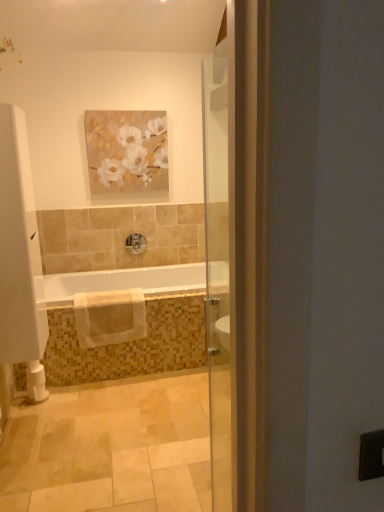
Question: From the image's perspective, would you say white towel at center is shown under matte floral painting at upper center?

Choices:
 (A) yes
 (B) no

Answer: (A)

Question: From a real-world perspective, is white towel at center under matte floral painting at upper center?

Choices:
 (A) yes
 (B) no

Answer: (A)

Question: Considering the relative sizes of white towel at center and matte floral painting at upper center in the image provided, is white towel at center thinner than matte floral painting at upper center?

Choices:
 (A) yes
 (B) no

Answer: (B)

Question: From a real-world perspective, is white towel at center on matte floral painting at upper center?

Choices:
 (A) yes
 (B) no

Answer: (B)

Question: Is white towel at center located outside matte floral painting at upper center?

Choices:
 (A) yes
 (B) no

Answer: (A)

Question: Is point (130, 236) positioned closer to the camera than point (160, 116)?

Choices:
 (A) farther
 (B) closer

Answer: (A)

Question: Considering the positions of satin nickel faucet at center and matte floral painting at upper center in the image, is satin nickel faucet at center taller or shorter than matte floral painting at upper center?

Choices:
 (A) short
 (B) tall

Answer: (A)

Question: Considering their positions, is satin nickel faucet at center located in front of or behind matte floral painting at upper center?

Choices:
 (A) behind
 (B) front

Answer: (A)

Question: In terms of width, does satin nickel faucet at center look wider or thinner when compared to matte floral painting at upper center?

Choices:
 (A) thin
 (B) wide

Answer: (B)

Question: From a real-world perspective, is satin nickel faucet at center positioned above or below white glossy bathtub at center?

Choices:
 (A) above
 (B) below

Answer: (A)

Question: Is point (142, 238) closer or farther from the camera than point (41, 301)?

Choices:
 (A) closer
 (B) farther

Answer: (B)

Question: Is satin nickel faucet at center in front of or behind white glossy bathtub at center in the image?

Choices:
 (A) front
 (B) behind

Answer: (B)

Question: Is satin nickel faucet at center inside the boundaries of white glossy bathtub at center, or outside?

Choices:
 (A) inside
 (B) outside

Answer: (B)

Question: From a real-world perspective, is matte floral painting at upper center above or below beige cotton towel at lower center?

Choices:
 (A) above
 (B) below

Answer: (A)

Question: In terms of size, does matte floral painting at upper center appear bigger or smaller than beige cotton towel at lower center?

Choices:
 (A) big
 (B) small

Answer: (B)